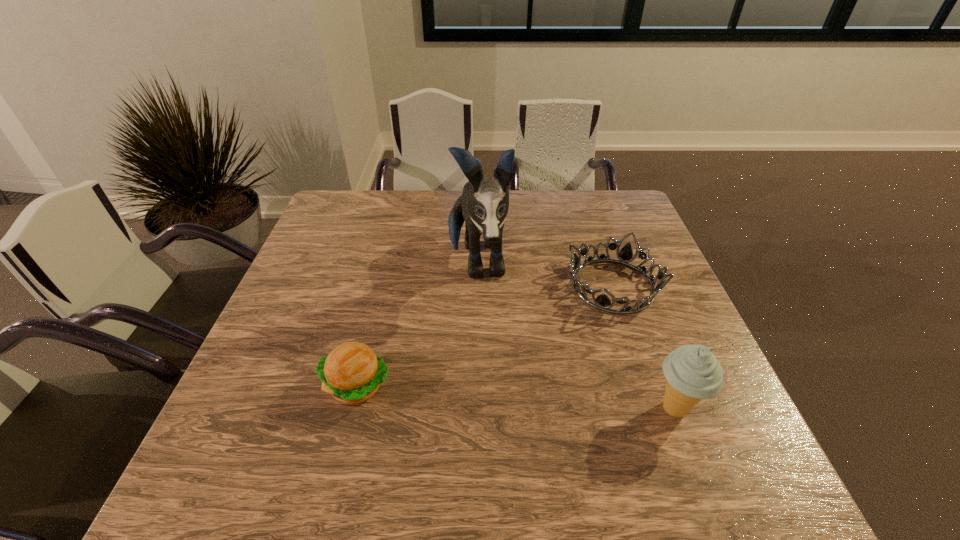
I want to click on vacant space on the desktop that is between the leftmost object and the icecream and is positioned on the front-facing side of the tiara, so click(x=559, y=401).

Identify the location of vacant space on the desktop that is between the leftmost object and the second tallest object and is positioned on the front-facing side of the tallest object. Image resolution: width=960 pixels, height=540 pixels. click(x=494, y=396).